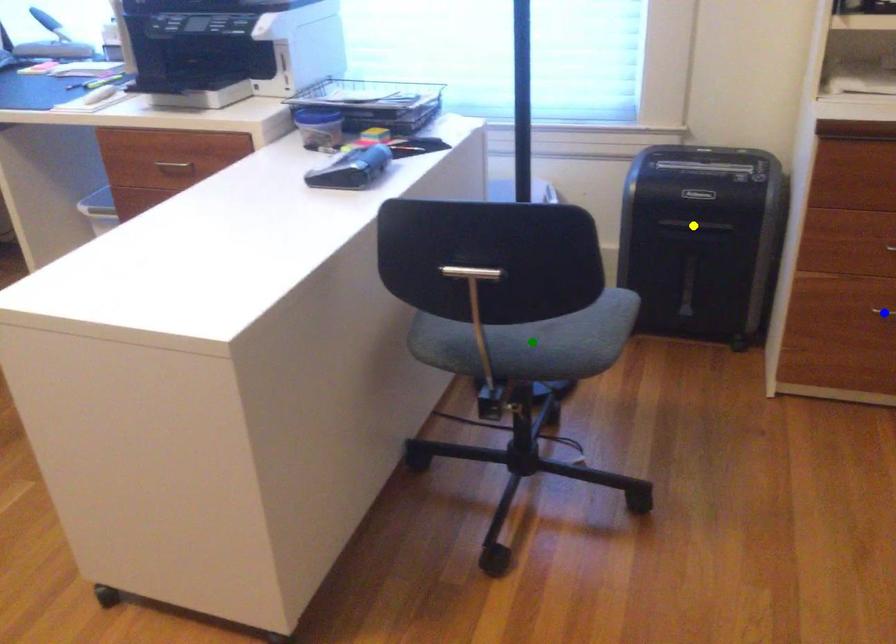
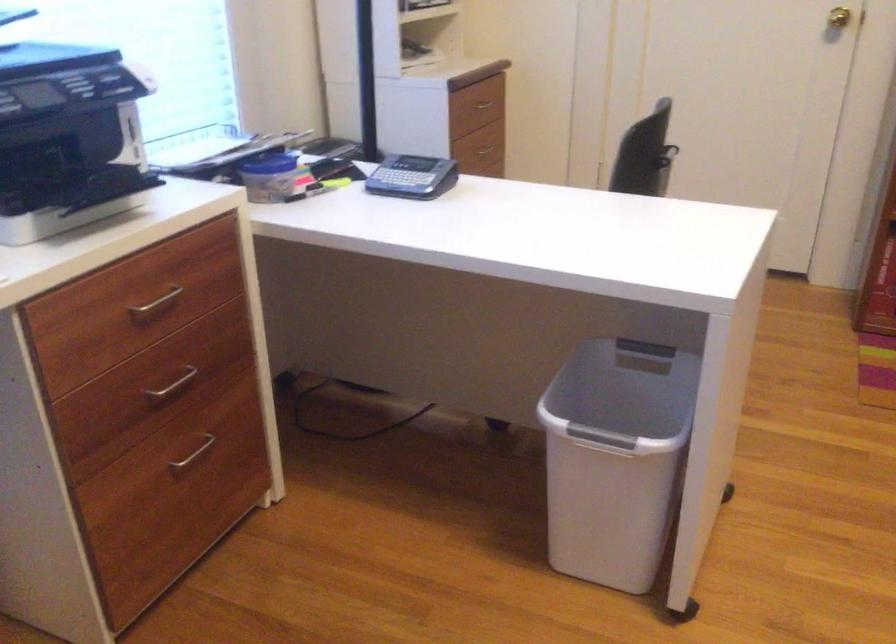
I am providing you with two images of the same scene from different viewpoints. Three points are marked in image1. Which point corresponds to a part or object that is occluded in image2?In image1, three points are marked. Which of them correspond to a part or object that is occluded in image2?Among the three points shown in image1, which one corresponds to a part or object that is no longer visible due to occlusion in image2?

green point, blue point, yellow point cannot be seen in image2.